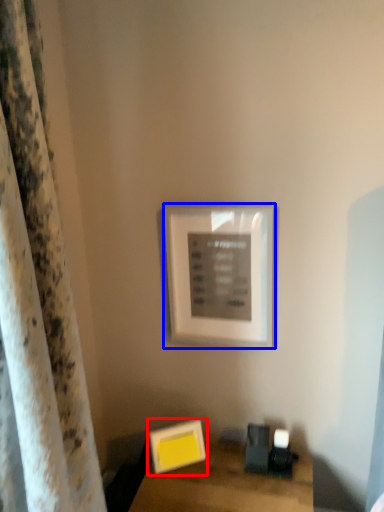
Question: Which object appears farthest to the camera in this image, picture frame (highlighted by a red box) or picture frame (highlighted by a blue box)?

Choices:
 (A) picture frame
 (B) picture frame

Answer: (A)